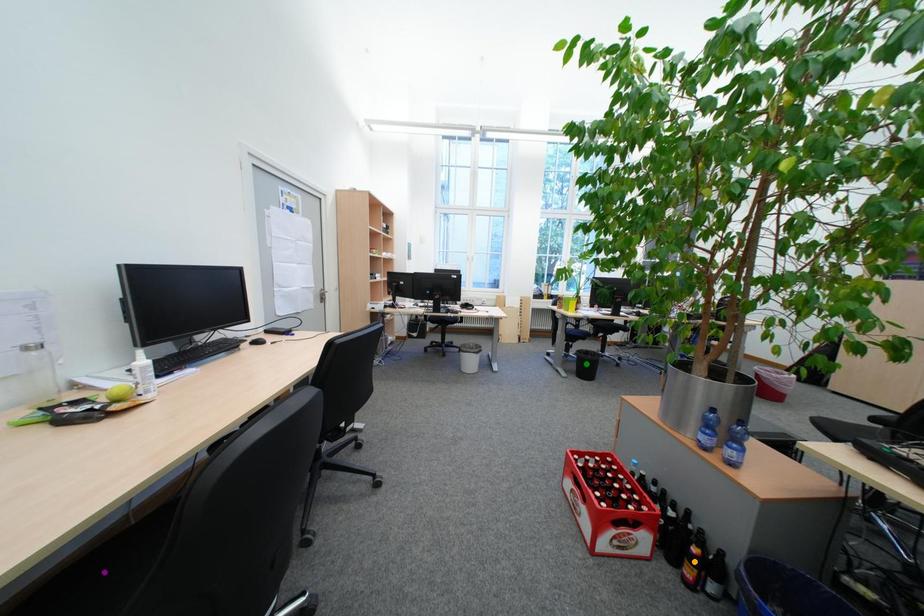
Order these from nearest to farthest:
- purple point
- orange point
- green point

purple point < orange point < green point